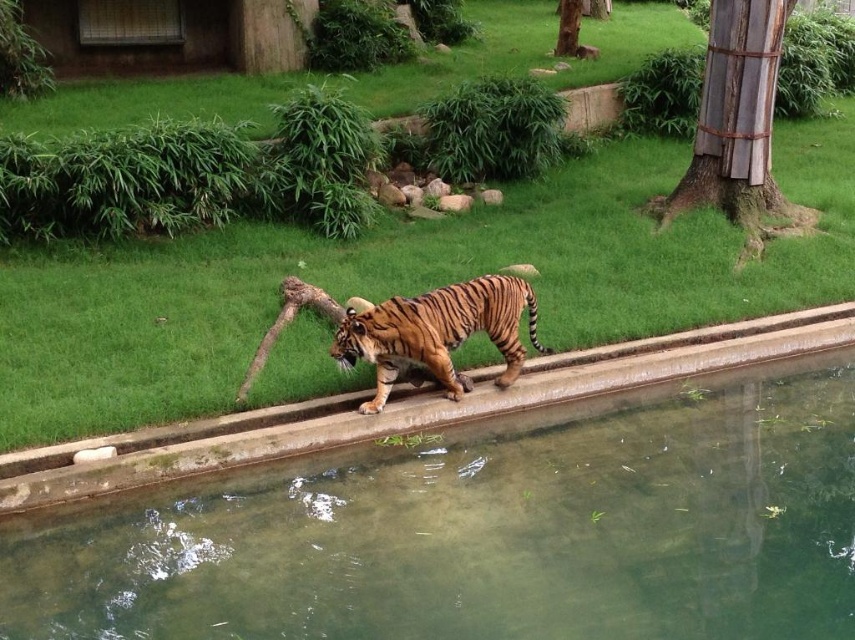
Can you confirm if green grass at center is positioned above orange-brown striped tiger at center?

Yes.

Can you confirm if green grass at center is thinner than orange-brown striped tiger at center?

In fact, green grass at center might be wider than orange-brown striped tiger at center.

Is point (551, 230) farther from camera compared to point (444, 342)?

Yes, point (551, 230) is farther from viewer.

Find the location of a particular element. This screenshot has width=855, height=640. green grass at center is located at coordinates (404, 280).

Can you confirm if clear glass water at center is taller than orange-brown striped tiger at center?

Yes.

Can you confirm if clear glass water at center is positioned to the right of orange-brown striped tiger at center?

Indeed, clear glass water at center is positioned on the right side of orange-brown striped tiger at center.

You are a GUI agent. You are given a task and a screenshot of the screen. Output one action in this format:
    pyautogui.click(x=<x>, y=<y>)
    Task: Click on the clear glass water at center
    
    Given the screenshot: What is the action you would take?
    pyautogui.click(x=486, y=529)

Image resolution: width=855 pixels, height=640 pixels. Identify the location of clear glass water at center. (486, 529).

Can you confirm if clear glass water at center is thinner than green grass at center?

Yes.

Can you confirm if clear glass water at center is bigger than green grass at center?

No.

In order to click on clear glass water at center in this screenshot , I will do `click(486, 529)`.